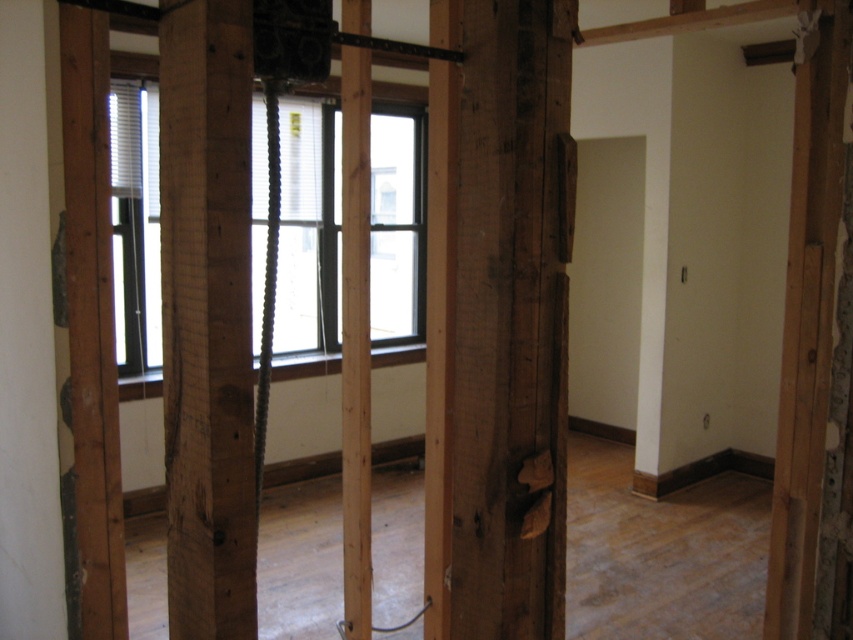
You are standing in a construction site and want to reach a specific point marked at coordinates point (393, 204). If you walk straight ahead, will you reach that point before walking 10 meters?

The point (393, 204) is 9.68 meters from the camera, so yes, you will reach it before walking 10 meters.

You are a contractor inspecting the construction site. You notice the white matte blinds at left and the clear glass window at center. Which object is closer to the outside of the building?

The clear glass window at center is closer to the outside of the building because the white matte blinds at left are positioned behind it.

You are an interior designer assessing the space. You need to hang a large painting that requires a height of 2 meters. Given the clear glass window at center and the white matte blinds at left, which object allows enough vertical space for the painting?

The clear glass window at center is much taller than the white matte blinds at left, so the painting can be hung on the clear glass window at center as it provides sufficient vertical space.